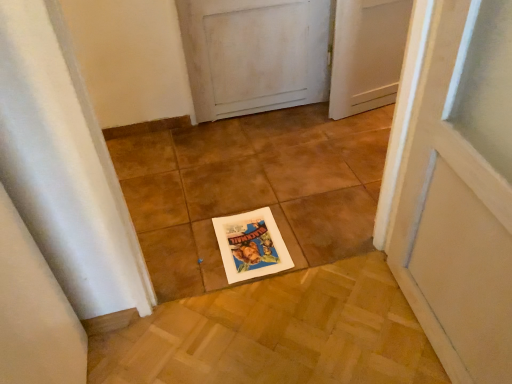
Question: Considering the relative positions of brown tile at center and white paper postcard at center in the image provided, is brown tile at center in front of white paper postcard at center?

Choices:
 (A) yes
 (B) no

Answer: (A)

Question: Does brown tile at center appear on the right side of white paper postcard at center?

Choices:
 (A) no
 (B) yes

Answer: (B)

Question: From the image's perspective, is brown tile at center on top of white paper postcard at center?

Choices:
 (A) no
 (B) yes

Answer: (B)

Question: Considering the relative positions of brown tile at center and white paper postcard at center in the image provided, is brown tile at center behind white paper postcard at center?

Choices:
 (A) yes
 (B) no

Answer: (B)

Question: Is brown tile at center shorter than white paper postcard at center?

Choices:
 (A) yes
 (B) no

Answer: (B)

Question: Are brown tile at center and white paper postcard at center far apart?

Choices:
 (A) yes
 (B) no

Answer: (B)

Question: Is white paper postcard at center smaller than brown tile at center?

Choices:
 (A) yes
 (B) no

Answer: (A)

Question: Is the position of white paper postcard at center more distant than that of brown tile at center?

Choices:
 (A) yes
 (B) no

Answer: (A)

Question: Can you confirm if white paper postcard at center is wider than brown tile at center?

Choices:
 (A) yes
 (B) no

Answer: (A)

Question: Does white paper postcard at center have a larger size compared to brown tile at center?

Choices:
 (A) yes
 (B) no

Answer: (B)

Question: Does white paper postcard at center have a greater height compared to brown tile at center?

Choices:
 (A) yes
 (B) no

Answer: (B)

Question: Considering the relative positions of white paper postcard at center and brown tile at center in the image provided, is white paper postcard at center to the right of brown tile at center from the viewer's perspective?

Choices:
 (A) yes
 (B) no

Answer: (B)

Question: In terms of height, does brown tile at center look taller or shorter compared to white paper postcard at center?

Choices:
 (A) tall
 (B) short

Answer: (A)